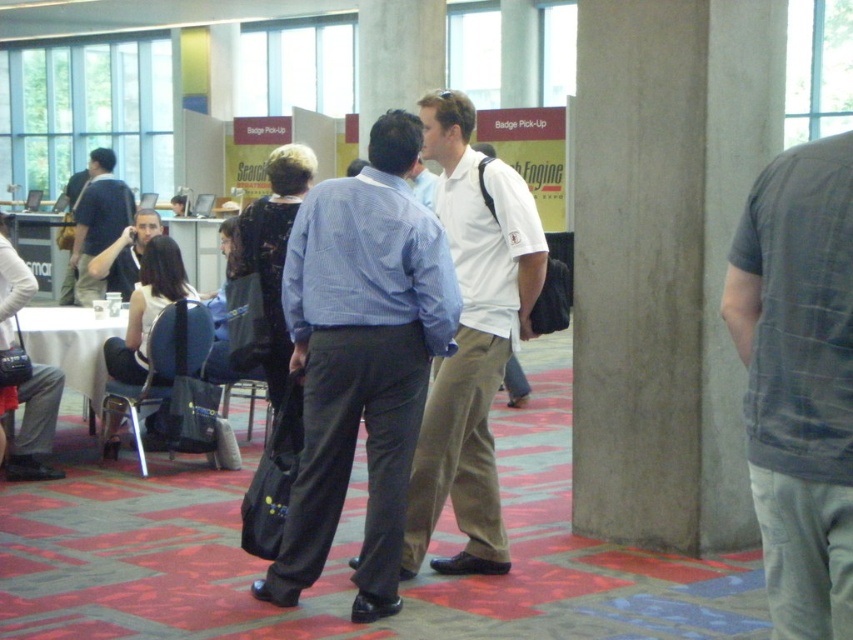
Is blue checkered shirt at center further to camera compared to gray plaid shirt at center?

Yes, it is.

Is point (426, 349) positioned before point (738, 330)?

That is False.

At what (x,y) coordinates should I click in order to perform the action: click on blue checkered shirt at center. Please return your answer as a coordinate pair (x, y). Looking at the image, I should click on (361, 358).

Does point (352, 260) come in front of point (119, 257)?

Yes, it is.

Does blue checkered shirt at center appear on the left side of matte black shirt at left?

No, blue checkered shirt at center is not to the left of matte black shirt at left.

The width and height of the screenshot is (853, 640). I want to click on blue checkered shirt at center, so tap(361, 358).

Identify the location of blue checkered shirt at center. (361, 358).

Is blue checkered shirt at center shorter than white cotton shirt at center?

Correct, blue checkered shirt at center is not as tall as white cotton shirt at center.

Identify the location of blue checkered shirt at center. Image resolution: width=853 pixels, height=640 pixels. (361, 358).